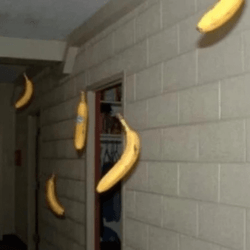
The height and width of the screenshot is (250, 250). Identify the location of box on shelf in closet. (111, 98).